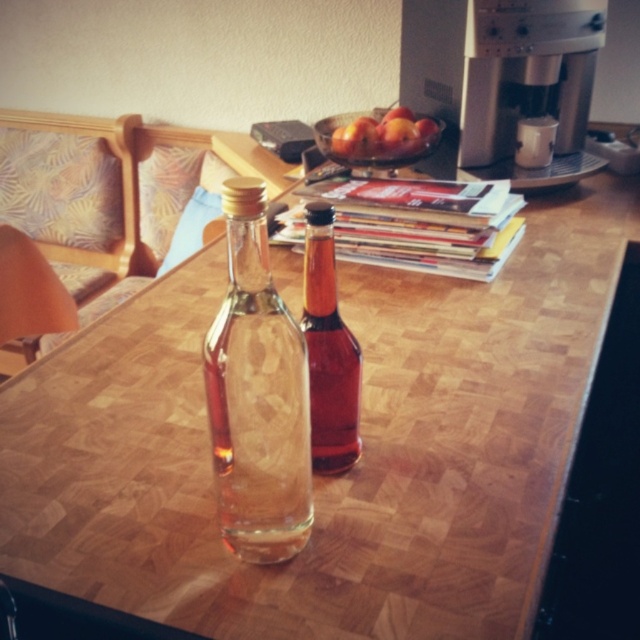
Is clear glass bottle at center bigger than translucent glass bottle at center?

Yes.

Image resolution: width=640 pixels, height=640 pixels. Find the location of `clear glass bottle at center`. clear glass bottle at center is located at coordinates (257, 396).

This screenshot has height=640, width=640. Identify the location of clear glass bottle at center. (257, 396).

Looking at this image, can you confirm if clear glass bottle at center is positioned to the right of smooth red apples at center?

Incorrect, clear glass bottle at center is not on the right side of smooth red apples at center.

How much distance is there between clear glass bottle at center and smooth red apples at center?

They are 87.97 centimeters apart.

Measure the distance between clear glass bottle at center and camera.

clear glass bottle at center is 41.37 centimeters from camera.

Find the location of `clear glass bottle at center`. clear glass bottle at center is located at coordinates (257, 396).

Between point (435, 113) and point (310, 304), which one is positioned in front?

Positioned in front is point (310, 304).

Image resolution: width=640 pixels, height=640 pixels. I want to click on silver metallic coffee machine at upper right, so click(504, 77).

Identify the location of silver metallic coffee machine at upper right. This screenshot has width=640, height=640. (504, 77).